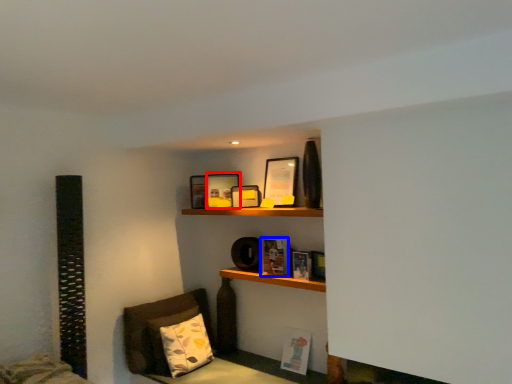
Question: Which point is further to the camera, picture frame (highlighted by a red box) or book (highlighted by a blue box)?

Choices:
 (A) picture frame
 (B) book

Answer: (A)